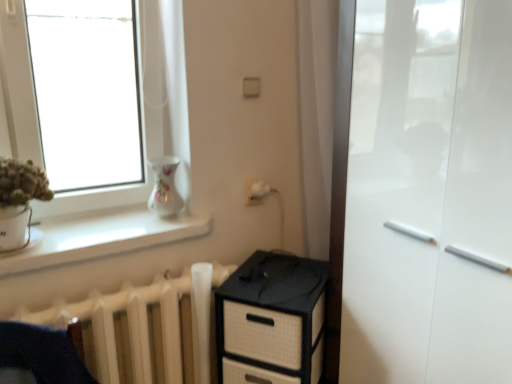
Question: From a real-world perspective, is white smooth window sill at lower left on top of white glossy cabinet at right?

Choices:
 (A) yes
 (B) no

Answer: (A)

Question: Is white smooth window sill at lower left aimed at white glossy cabinet at right?

Choices:
 (A) no
 (B) yes

Answer: (A)

Question: Does white smooth window sill at lower left have a greater width compared to white glossy cabinet at right?

Choices:
 (A) no
 (B) yes

Answer: (A)

Question: Considering the relative sizes of white smooth window sill at lower left and white glossy cabinet at right in the image provided, is white smooth window sill at lower left thinner than white glossy cabinet at right?

Choices:
 (A) yes
 (B) no

Answer: (A)

Question: Is white smooth window sill at lower left touching white glossy cabinet at right?

Choices:
 (A) no
 (B) yes

Answer: (A)

Question: Visually, is black woven chest of drawers at lower center positioned to the left or to the right of white matte radiator at lower left?

Choices:
 (A) right
 (B) left

Answer: (A)

Question: Is black woven chest of drawers at lower center wider or thinner than white matte radiator at lower left?

Choices:
 (A) wide
 (B) thin

Answer: (A)

Question: Considering the positions of black woven chest of drawers at lower center and white matte radiator at lower left in the image, is black woven chest of drawers at lower center taller or shorter than white matte radiator at lower left?

Choices:
 (A) short
 (B) tall

Answer: (B)

Question: Looking at the image, does black woven chest of drawers at lower center seem bigger or smaller compared to white matte radiator at lower left?

Choices:
 (A) small
 (B) big

Answer: (B)

Question: Does point (152, 162) appear closer or farther from the camera than point (367, 19)?

Choices:
 (A) closer
 (B) farther

Answer: (B)

Question: Considering the positions of porcelain floral vase at upper left and white glossy cabinet at right in the image, is porcelain floral vase at upper left taller or shorter than white glossy cabinet at right?

Choices:
 (A) tall
 (B) short

Answer: (B)

Question: Is porcelain floral vase at upper left in front of or behind white glossy cabinet at right in the image?

Choices:
 (A) front
 (B) behind

Answer: (B)

Question: Looking at their shapes, would you say porcelain floral vase at upper left is wider or thinner than white glossy cabinet at right?

Choices:
 (A) thin
 (B) wide

Answer: (A)

Question: From a real-world perspective, is white glossy cabinet at right physically located above or below black woven chest of drawers at lower center?

Choices:
 (A) above
 (B) below

Answer: (A)

Question: Would you say white glossy cabinet at right is inside or outside black woven chest of drawers at lower center?

Choices:
 (A) inside
 (B) outside

Answer: (B)